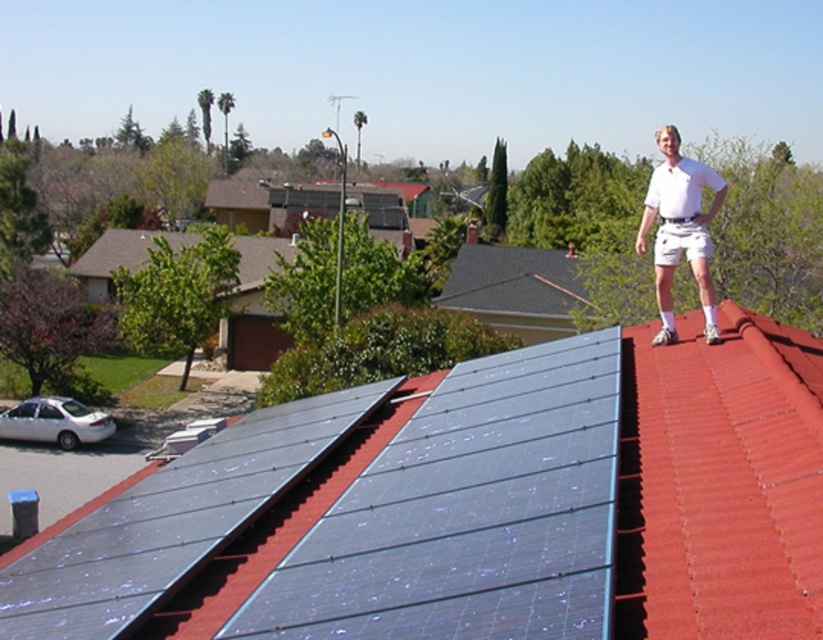
Question: Which point is farther from the camera taking this photo?

Choices:
 (A) (472, 497)
 (B) (110, 509)
 (C) (715, 336)

Answer: (C)

Question: Does blue metallic solar panels at upper center appear on the left side of blue glossy solar panel at center?

Choices:
 (A) yes
 (B) no

Answer: (A)

Question: Is blue metallic solar panels at upper center to the left of white cotton shirt at upper right from the viewer's perspective?

Choices:
 (A) no
 (B) yes

Answer: (B)

Question: Which object is positioned farthest from the blue glossy solar panel at center?

Choices:
 (A) white cotton shirt at upper right
 (B) blue metallic solar panels at upper center

Answer: (A)

Question: Is the position of blue metallic solar panels at upper center more distant than that of white cotton shirt at upper right?

Choices:
 (A) yes
 (B) no

Answer: (B)

Question: Which of these objects is positioned closest to the white cotton shirt at upper right?

Choices:
 (A) blue metallic solar panels at upper center
 (B) blue glossy solar panel at center

Answer: (B)